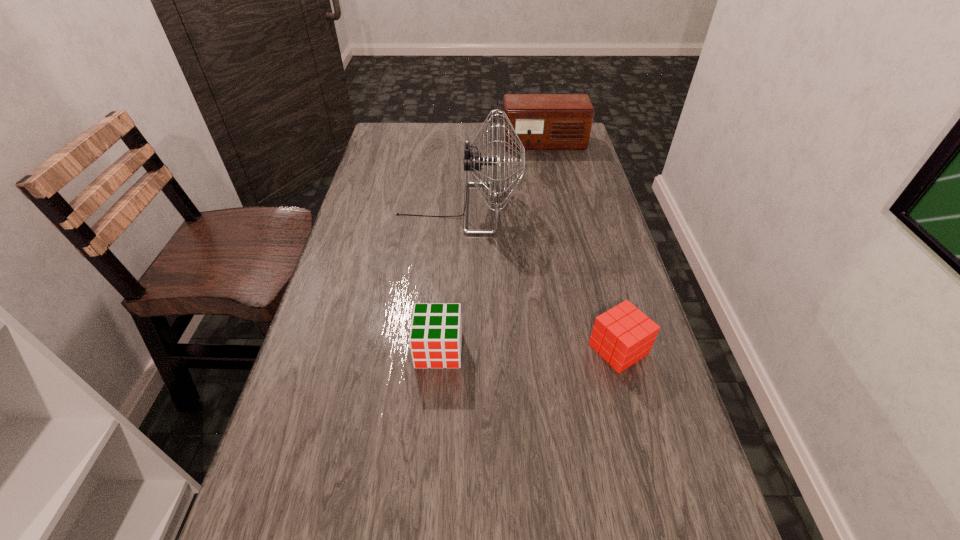
Image resolution: width=960 pixels, height=540 pixels. Find the location of `the second farthest object`. the second farthest object is located at coordinates (472, 160).

Identify the location of fan. (472, 160).

Locate an element on the screen. the farthest object is located at coordinates (542, 121).

Locate an element on the screen. the third shortest object is located at coordinates (542, 121).

Image resolution: width=960 pixels, height=540 pixels. I want to click on the left cube, so click(435, 338).

You are a GUI agent. You are given a task and a screenshot of the screen. Output one action in this format:
    pyautogui.click(x=<x>, y=<y>)
    Task: Click on the right cube
    
    Given the screenshot: What is the action you would take?
    623,335

Identify the location of vacant space located 0.200m on the front-facing side of the fan. This screenshot has width=960, height=540. (589, 208).

The image size is (960, 540). Identify the location of vacant area situated 0.350m on the front-facing side of the second tallest object. 559,215.

What are the coordinates of `free space located 0.130m on the red face of the left cube` in the screenshot? It's located at (432, 430).

The width and height of the screenshot is (960, 540). Identify the location of free space located on the back of the right cube. (608, 309).